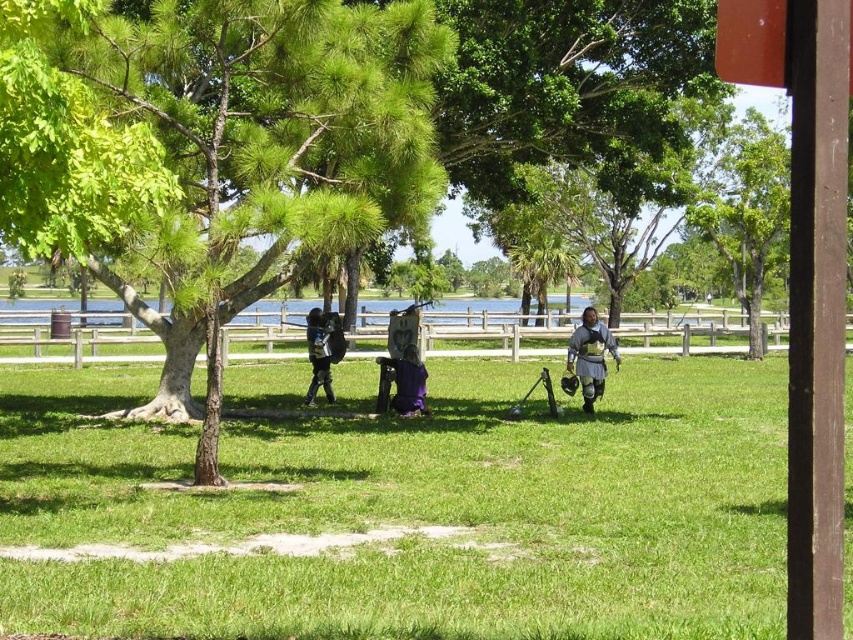
You are a knight in the park and need to place your sword on the ground between the green grassy field at center and the purple velvet bag at center. Which object should you place it closer to?

You should place your sword closer to the purple velvet bag at center because the green grassy field at center is located to the right of the purple velvet bag at center, meaning the bag is to the left of the field. Therefore, placing the sword closer to the bag ensures it is between the two objects.

You are planning to place a purple velvet bag at center in a park scene with three medieval armored individuals. Given that the green grassy field at center is larger than the bag, will the bag be fully visible in the scene?

The green grassy field at center is bigger than the purple velvet bag at center, so the bag will be fully visible as it is smaller in size and placed on the larger field.